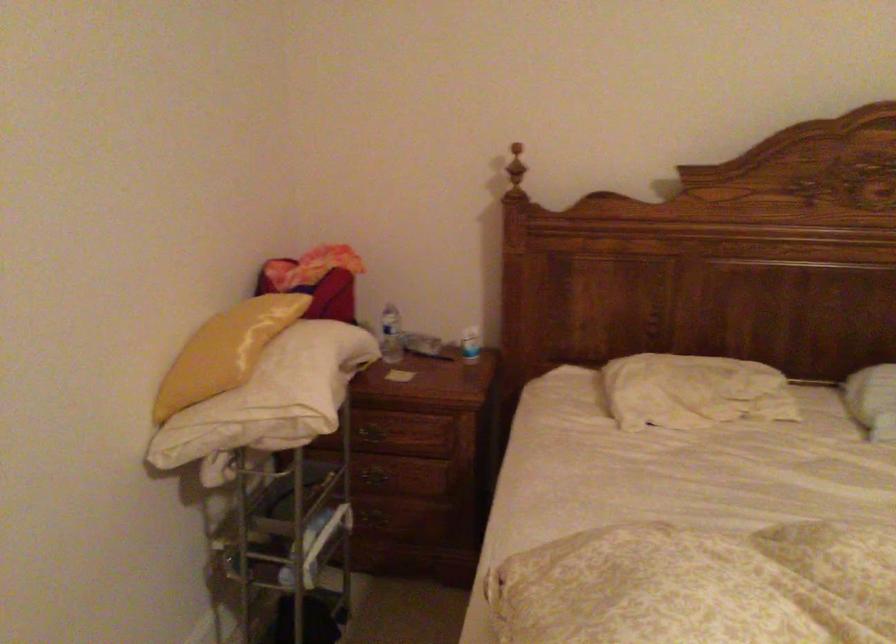
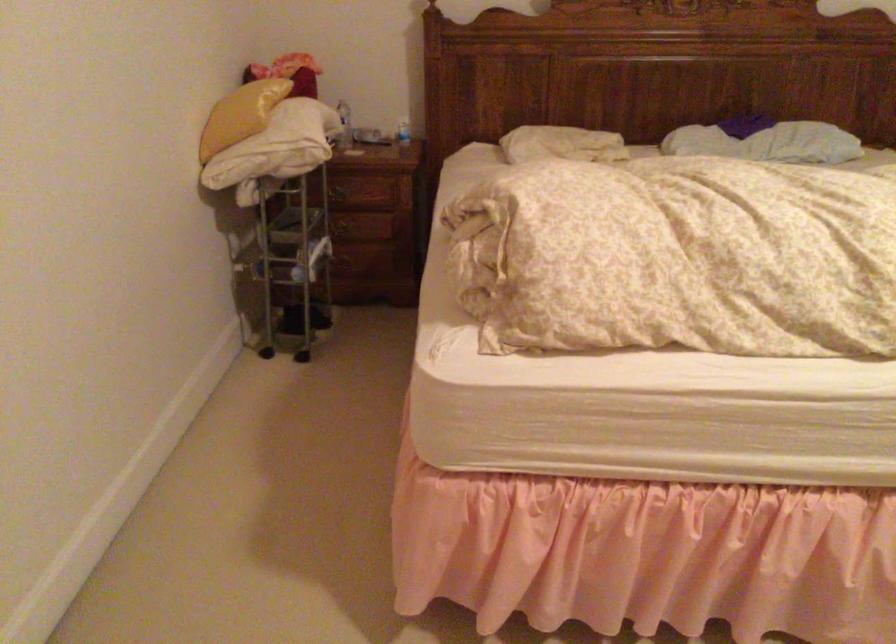
Locate, in the second image, the point that corresponds to [371,483] in the first image.

(342, 230)